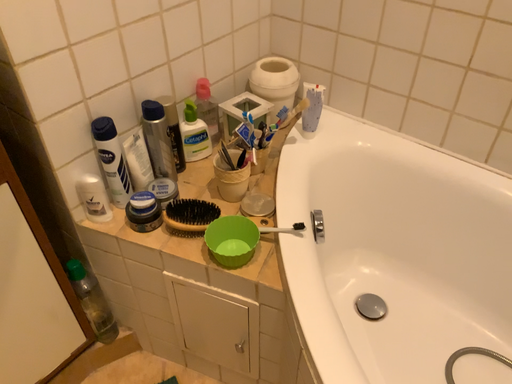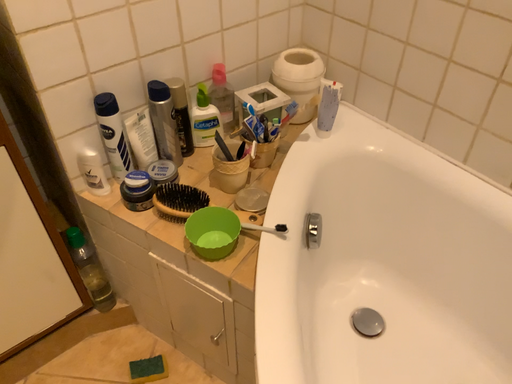
Question: Which way did the camera rotate in the video?

Choices:
 (A) rotated right
 (B) rotated left

Answer: (B)